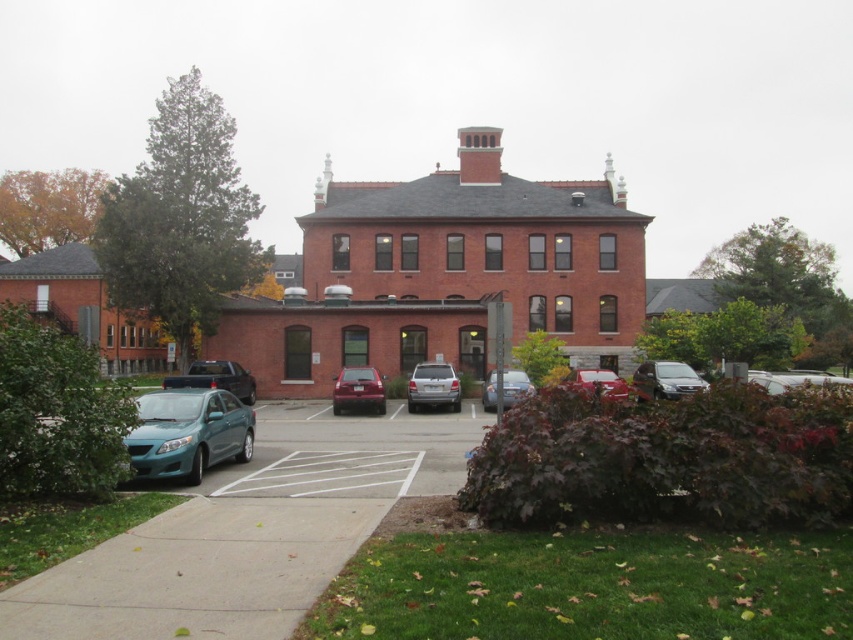
Question: Which object appears closest to the camera in this image?

Choices:
 (A) glossy red car at center
 (B) satin silver sedan at center
 (C) satin silver minivan at center

Answer: (C)

Question: Is glossy red car at center below metallic silver sedan at center?

Choices:
 (A) no
 (B) yes

Answer: (B)

Question: Which point is farther to the camera?

Choices:
 (A) (454, 388)
 (B) (698, 378)
 (C) (265, 634)

Answer: (B)

Question: Is matte black truck at center to the right of satin silver suv at center from the viewer's perspective?

Choices:
 (A) no
 (B) yes

Answer: (A)

Question: Can you confirm if matte black truck at center is bigger than satin silver suv at center?

Choices:
 (A) no
 (B) yes

Answer: (B)

Question: Considering the real-world distances, which object is farthest from the smooth concrete pavement at lower center?

Choices:
 (A) satin silver suv at center
 (B) glossy red car at center
 (C) satin silver minivan at center

Answer: (C)